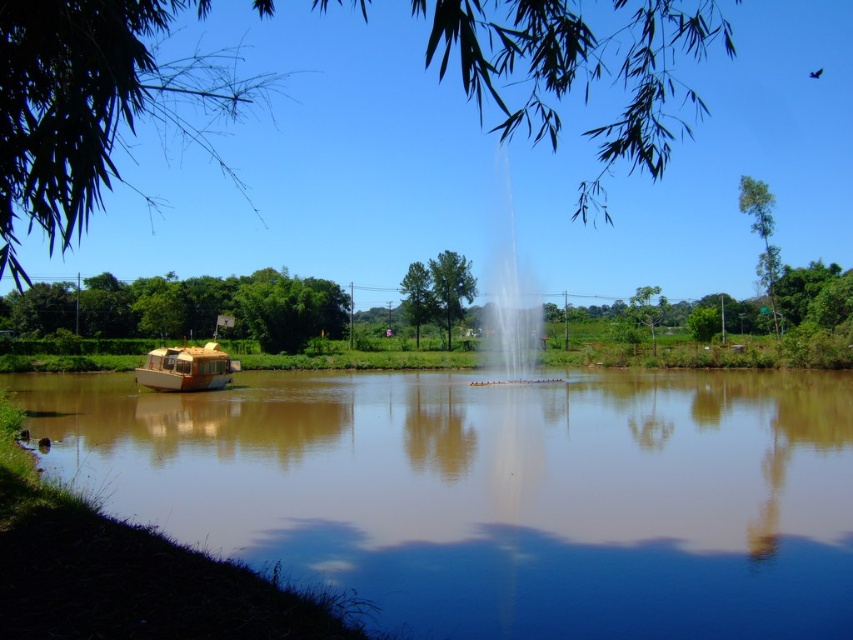
Question: Is wooden boat at left positioned in front of green leafy tree at upper right?

Choices:
 (A) yes
 (B) no

Answer: (A)

Question: Which object is closer to the camera taking this photo?

Choices:
 (A) clear water fountain at center
 (B) brown matte river at center
 (C) green leafy tree at upper right

Answer: (B)

Question: Does wooden boat at left appear under green matte tree at center?

Choices:
 (A) no
 (B) yes

Answer: (B)

Question: Does wooden boat at left appear on the left side of green leafy tree at upper right?

Choices:
 (A) yes
 (B) no

Answer: (A)

Question: Among these objects, which one is nearest to the camera?

Choices:
 (A) green leafy tree at upper center
 (B) green leafy tree at left

Answer: (A)

Question: Among these points, which one is nearest to the camera?

Choices:
 (A) (177, 365)
 (B) (775, 307)
 (C) (442, 310)

Answer: (A)